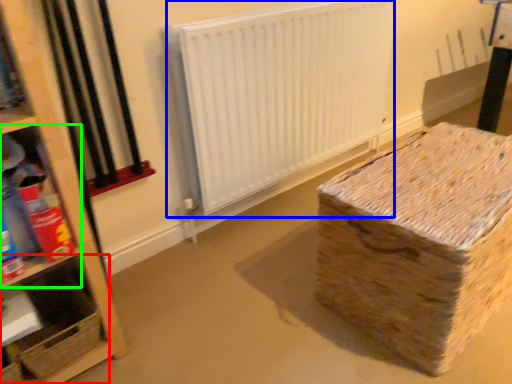
Question: Based on their relative distances, which object is farther from shelf (highlighted by a red box)? Choose from radiator (highlighted by a blue box) and shelf (highlighted by a green box).

Choices:
 (A) radiator
 (B) shelf

Answer: (A)